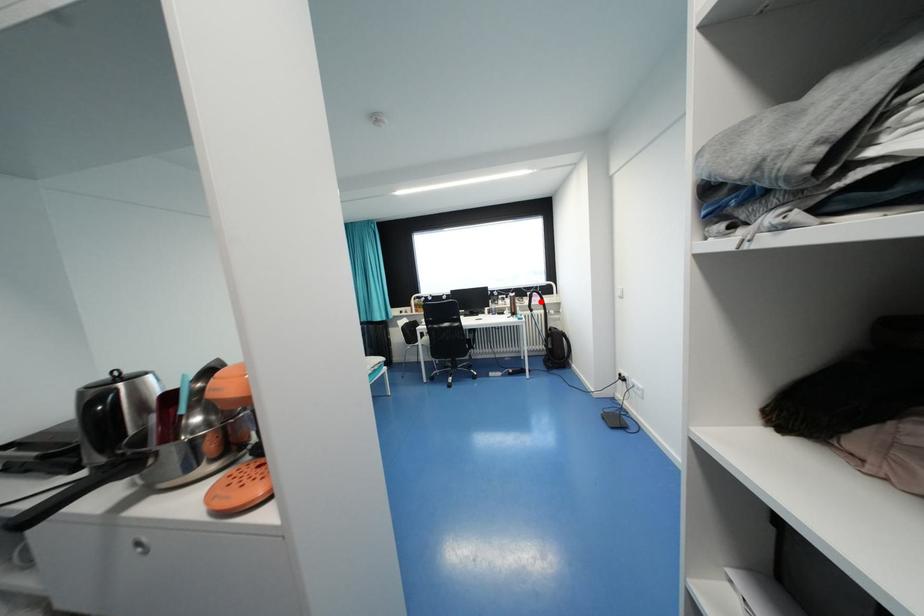
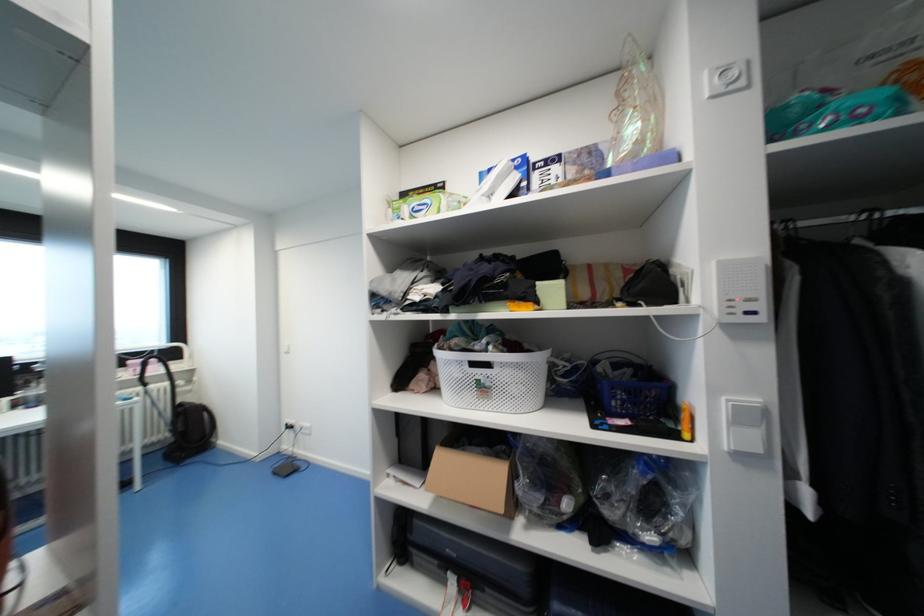
Locate, in the second image, the point that corresponds to the highlighted location in the first image.

(160, 371)